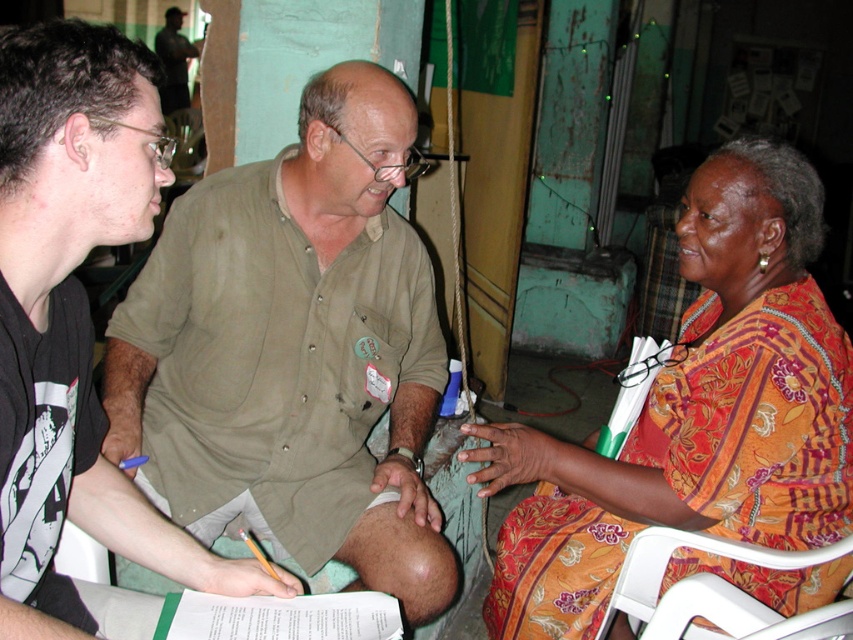
Question: Does green cotton shirt at center have a larger size compared to green matte shirt at left?

Choices:
 (A) yes
 (B) no

Answer: (A)

Question: From the image, what is the correct spatial relationship of floral print fabric at right in relation to white plastic folding chair at lower right?

Choices:
 (A) below
 (B) above

Answer: (B)

Question: Which object appears farthest from the camera in this image?

Choices:
 (A) floral print fabric at right
 (B) green cotton shirt at center
 (C) green matte shirt at left

Answer: (B)

Question: Which object is positioned farthest from the green cotton shirt at center?

Choices:
 (A) white plastic folding chair at lower right
 (B) green matte shirt at left
 (C) floral print fabric at right

Answer: (A)

Question: Is green cotton shirt at center below white plastic folding chair at lower right?

Choices:
 (A) yes
 (B) no

Answer: (B)

Question: Estimate the real-world distances between objects in this image. Which object is closer to the white plastic folding chair at lower right?

Choices:
 (A) green cotton shirt at center
 (B) floral print fabric at right

Answer: (B)